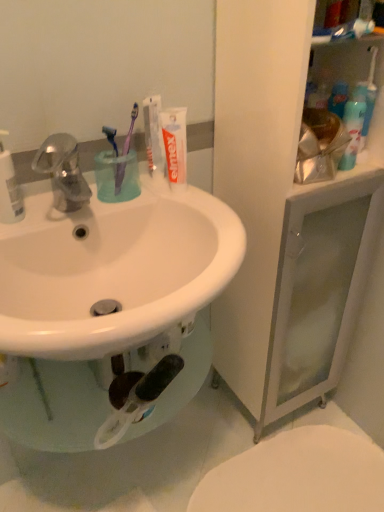
Question: From the image's perspective, would you say white matte toothpaste at upper center, positioned as the second toothpaste in right-to-left order, is shown under purple plastic toothbrush at upper center, which ranks as the second toothbrush in right-to-left order?

Choices:
 (A) no
 (B) yes

Answer: (A)

Question: From a real-world perspective, does white matte toothpaste at upper center, which appears as the first toothpaste when viewed from the left, sit lower than purple plastic toothbrush at upper center, placed as the first toothbrush when sorted from left to right?

Choices:
 (A) yes
 (B) no

Answer: (B)

Question: Does white matte toothpaste at upper center, positioned as the second toothpaste in right-to-left order, have a greater width compared to purple plastic toothbrush at upper center, placed as the first toothbrush when sorted from left to right?

Choices:
 (A) no
 (B) yes

Answer: (A)

Question: Is the surface of white matte toothpaste at upper center, which appears as the first toothpaste when viewed from the left, in direct contact with purple plastic toothbrush at upper center, which ranks as the second toothbrush in right-to-left order?

Choices:
 (A) no
 (B) yes

Answer: (B)

Question: From a real-world perspective, is white matte toothpaste at upper center, which appears as the first toothpaste when viewed from the left, on purple plastic toothbrush at upper center, which ranks as the second toothbrush in right-to-left order?

Choices:
 (A) yes
 (B) no

Answer: (A)

Question: Is purple plastic toothbrush at upper center, the 1th toothbrush positioned from the right, inside or outside of matte silver faucet at upper left?

Choices:
 (A) outside
 (B) inside

Answer: (A)

Question: In terms of size, does purple plastic toothbrush at upper center, which is the 2th toothbrush in left-to-right order, appear bigger or smaller than matte silver faucet at upper left?

Choices:
 (A) small
 (B) big

Answer: (A)

Question: In terms of width, does purple plastic toothbrush at upper center, the 1th toothbrush positioned from the right, look wider or thinner when compared to matte silver faucet at upper left?

Choices:
 (A) thin
 (B) wide

Answer: (A)

Question: From a real-world perspective, is purple plastic toothbrush at upper center, which is the 2th toothbrush in left-to-right order, physically located above or below matte silver faucet at upper left?

Choices:
 (A) below
 (B) above

Answer: (B)

Question: From the image's perspective, is white glossy toilet at lower right located above or below purple plastic toothbrush at upper center, which ranks as the second toothbrush in right-to-left order?

Choices:
 (A) below
 (B) above

Answer: (A)

Question: Is white glossy toilet at lower right spatially inside purple plastic toothbrush at upper center, which ranks as the second toothbrush in right-to-left order, or outside of it?

Choices:
 (A) inside
 (B) outside

Answer: (B)

Question: In terms of width, does white glossy toilet at lower right look wider or thinner when compared to purple plastic toothbrush at upper center, placed as the first toothbrush when sorted from left to right?

Choices:
 (A) wide
 (B) thin

Answer: (A)

Question: From a real-world perspective, is white glossy toilet at lower right physically located above or below purple plastic toothbrush at upper center, placed as the first toothbrush when sorted from left to right?

Choices:
 (A) above
 (B) below

Answer: (B)

Question: From the image's perspective, is white matte toothpaste at upper center, the 2th toothpaste in the left-to-right sequence, positioned above or below purple plastic toothbrush at upper center, which is the 2th toothbrush in left-to-right order?

Choices:
 (A) below
 (B) above

Answer: (A)

Question: Considering the positions of white matte toothpaste at upper center, placed as the 1th toothpaste when sorted from right to left, and purple plastic toothbrush at upper center, the 1th toothbrush positioned from the right, in the image, is white matte toothpaste at upper center, placed as the 1th toothpaste when sorted from right to left, bigger or smaller than purple plastic toothbrush at upper center, the 1th toothbrush positioned from the right,?

Choices:
 (A) big
 (B) small

Answer: (B)